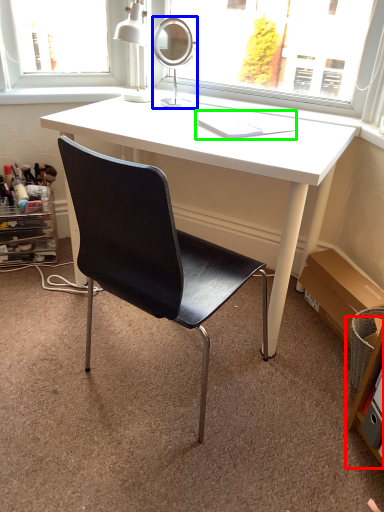
Question: Based on their relative distances, which object is farther from shelf (highlighted by a red box)? Choose from mirror (highlighted by a blue box) and book (highlighted by a green box).

Choices:
 (A) mirror
 (B) book

Answer: (A)